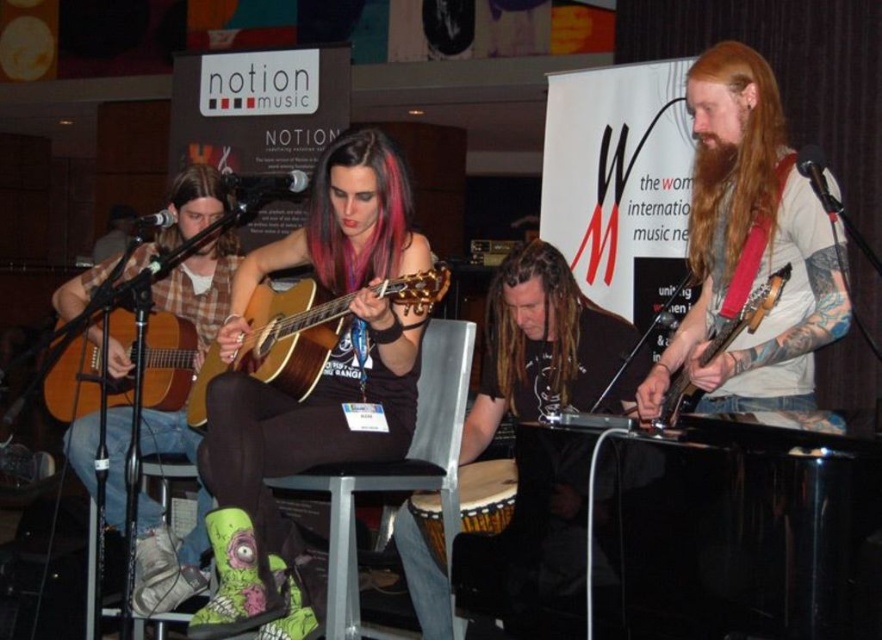
Question: Considering the real-world distances, which object is farthest from the pink dyed hair at upper center?

Choices:
 (A) wooden acoustic guitar at center
 (B) long brown dreadlocks at center
 (C) matte brown acoustic guitar at left

Answer: (B)

Question: Can you confirm if long brown dreadlocks at center is positioned to the left of matte brown electric guitar at right?

Choices:
 (A) no
 (B) yes

Answer: (B)

Question: Does pink dyed hair at center have a smaller size compared to pink dyed hair at upper center?

Choices:
 (A) yes
 (B) no

Answer: (B)

Question: Based on their relative distances, which object is nearer to the long brown dreadlocks at center?

Choices:
 (A) pink dyed hair at center
 (B) matte black guitar at center
 (C) long reddish-brown hair at right
 (D) wooden drum at lower center

Answer: (D)

Question: Observing the image, what is the correct spatial positioning of long brown dreadlocks at center in reference to pink dyed hair at upper center?

Choices:
 (A) left
 (B) right

Answer: (B)

Question: Among these points, which one is farthest from the camera?

Choices:
 (A) (783, 148)
 (B) (200, 387)
 (C) (505, 332)
 (D) (701, 362)

Answer: (C)